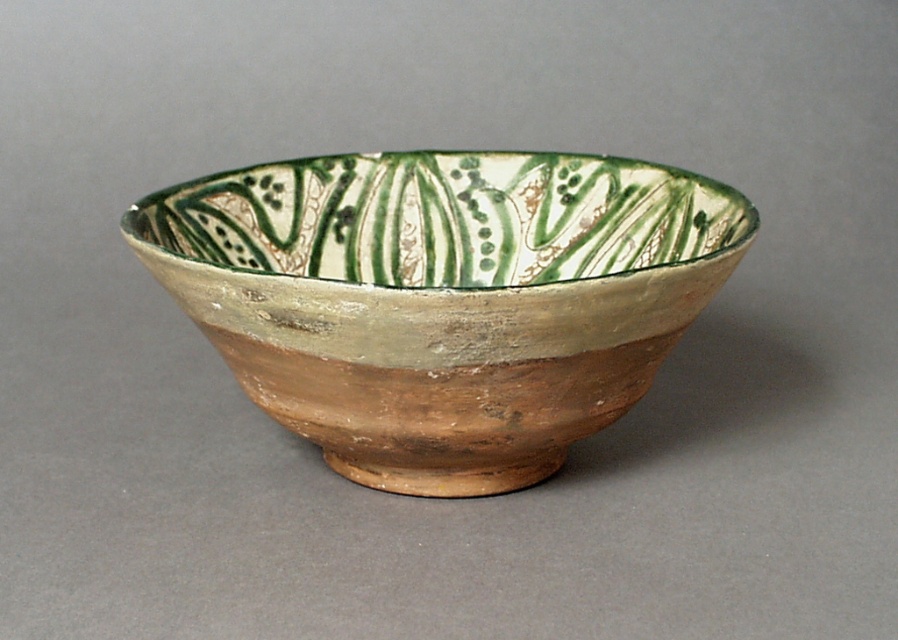
Describe the element at coordinates (443, 298) in the screenshot. I see `matte clay bowl at center` at that location.

Who is more distant from viewer, (326, 436) or (487, 160)?

Positioned behind is point (487, 160).

I want to click on matte clay bowl at center, so click(x=443, y=298).